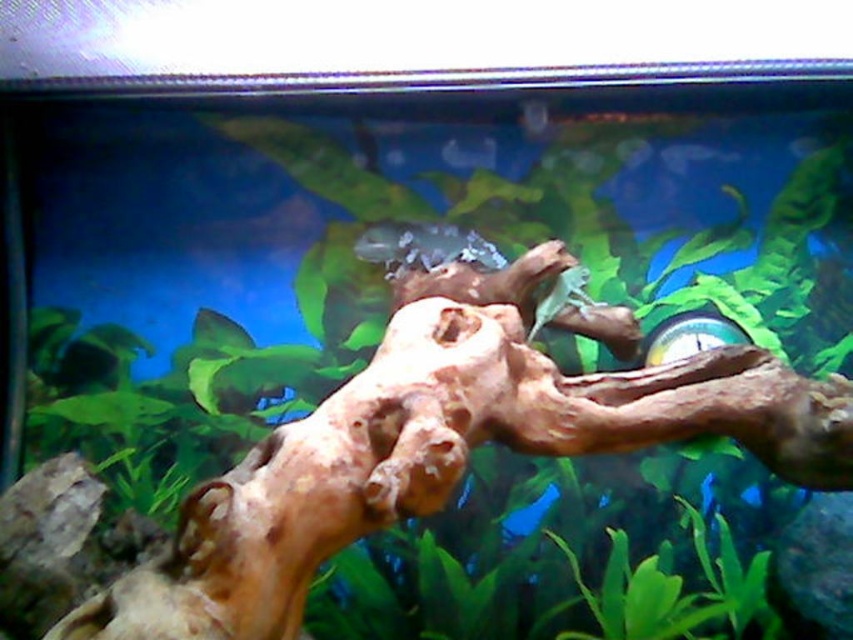
You are an aquatic plant that is 12 inches tall. You want to grow between the translucent glass fish at center and the translucent plastic fish at center. Is there enough space for you to fit in between them?

The distance between the translucent glass fish at center and the translucent plastic fish at center is 11.75 inches. Since the plant is 12 inches tall, it would not fit in the space between them.

You are an underwater photographer aiming to capture a closeup of the driftwood in the aquarium. You have two points marked in the scene, point 1 at coordinates point (479,243) and point 2 at coordinates point (482,163). Which point should you focus on to ensure the driftwood is in focus?

You should focus on point (479,243) because it is closer to the camera than point (482,163), ensuring the driftwood will be in focus.

You are an underwater explorer with a 2 meter long robotic arm. You are looking at the aquarium scene and want to reach the translucent glass fish at center. Can your robotic arm reach it?

The distance between the translucent glass fish at center and the viewer is 2.05 meters. Since the robotic arm is only 2 meters long, it cannot reach the fish as it is slightly farther away than the arm can extend.